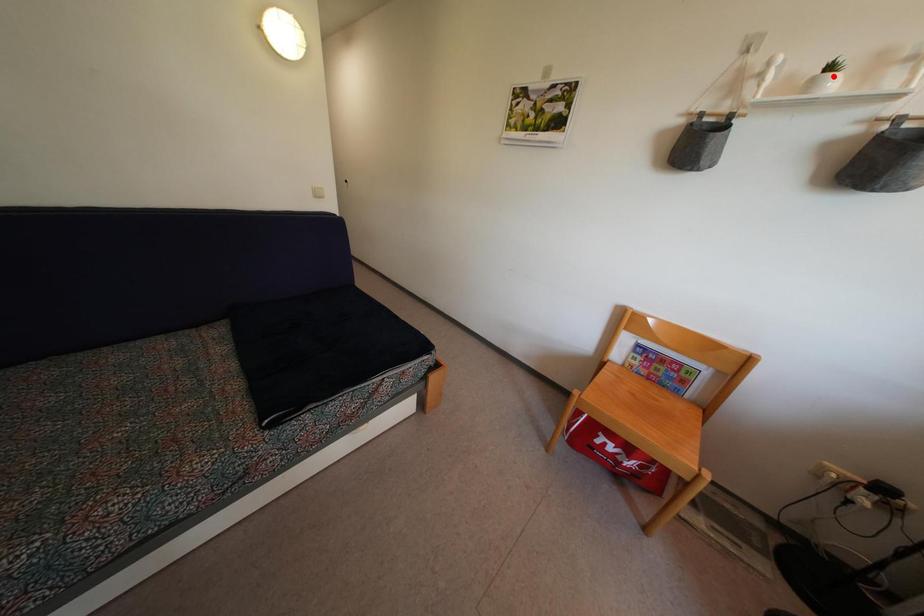
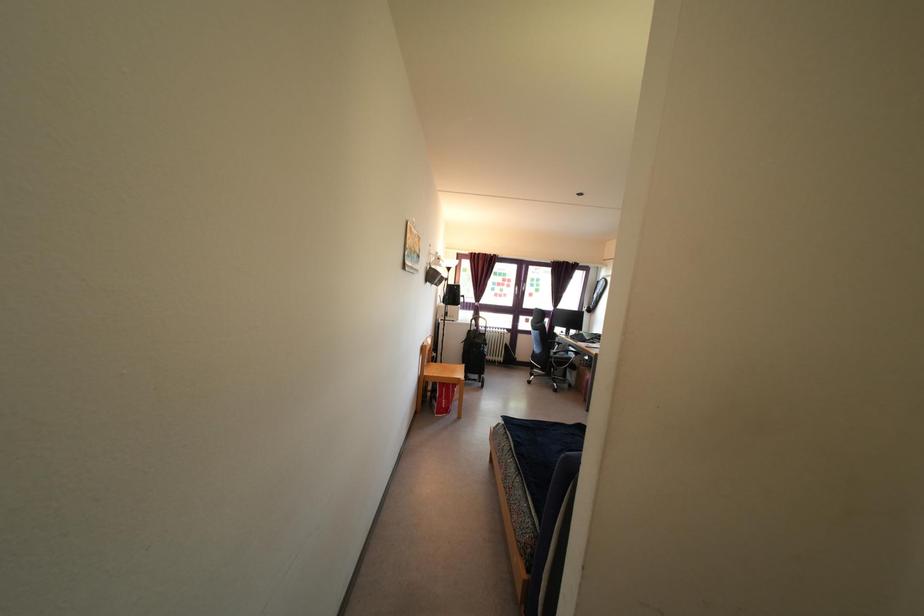
Question: I am providing you with two images of the same scene from different viewpoints. A red point is marked on the first image. Is the red point's position out of view in image 2?

Choices:
 (A) Yes
 (B) No

Answer: (A)